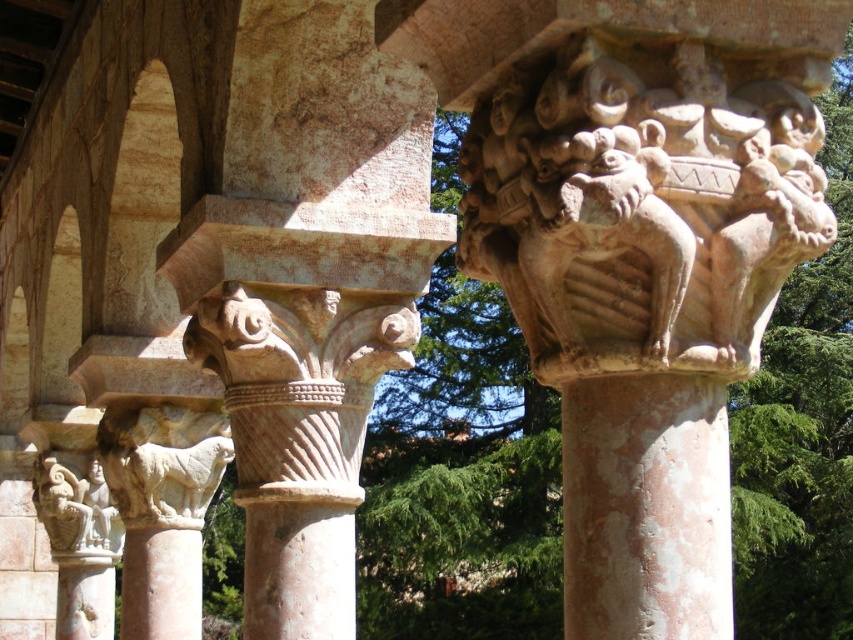
Question: In this image, where is beige stone sculpture at center located relative to pink stone column at center?

Choices:
 (A) above
 (B) below

Answer: (A)

Question: Which of these objects is positioned farthest from the pink stone column at center?

Choices:
 (A) beige stone sculpture at center
 (B) marble column at center
 (C) white stone statue at lower left

Answer: (B)

Question: Which point is farther to the camera?

Choices:
 (A) (358, 387)
 (B) (57, 467)
 (C) (761, 195)

Answer: (B)

Question: Which point is farther to the camera?

Choices:
 (A) (737, 372)
 (B) (62, 540)

Answer: (B)

Question: Can you confirm if marble column at center is positioned below white stone statue at lower left?

Choices:
 (A) yes
 (B) no

Answer: (B)

Question: Can you confirm if marble column at center is positioned above beige stone sculpture at center?

Choices:
 (A) no
 (B) yes

Answer: (B)